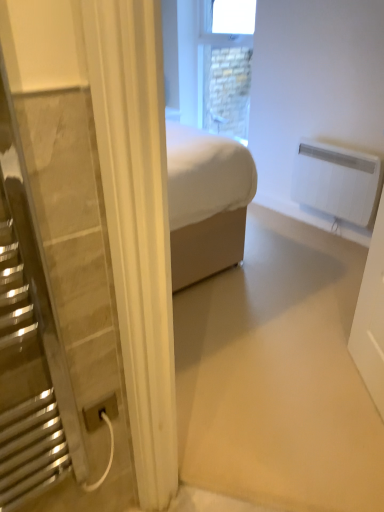
Question: Considering the relative sizes of white plastic radiator at upper right and white plastic power plug at lower left in the image provided, is white plastic radiator at upper right bigger than white plastic power plug at lower left?

Choices:
 (A) no
 (B) yes

Answer: (B)

Question: Is white plastic radiator at upper right at the right side of white plastic power plug at lower left?

Choices:
 (A) no
 (B) yes

Answer: (B)

Question: From a real-world perspective, is white plastic radiator at upper right beneath white plastic power plug at lower left?

Choices:
 (A) yes
 (B) no

Answer: (A)

Question: Is white plastic radiator at upper right further to the viewer compared to white plastic power plug at lower left?

Choices:
 (A) no
 (B) yes

Answer: (B)

Question: Is white plastic radiator at upper right closer to the viewer compared to white plastic power plug at lower left?

Choices:
 (A) yes
 (B) no

Answer: (B)

Question: From the image's perspective, is white plastic radiator at upper right on white plastic power plug at lower left?

Choices:
 (A) no
 (B) yes

Answer: (B)

Question: Is white plastic radiator at upper right oriented away from stone textured window at upper center?

Choices:
 (A) no
 (B) yes

Answer: (A)

Question: Is white plastic radiator at upper right closer to camera compared to stone textured window at upper center?

Choices:
 (A) yes
 (B) no

Answer: (A)

Question: Are white plastic radiator at upper right and stone textured window at upper center beside each other?

Choices:
 (A) yes
 (B) no

Answer: (B)

Question: Is stone textured window at upper center surrounded by white plastic radiator at upper right?

Choices:
 (A) yes
 (B) no

Answer: (B)

Question: Does white plastic radiator at upper right have a smaller size compared to stone textured window at upper center?

Choices:
 (A) yes
 (B) no

Answer: (A)

Question: Is white plastic radiator at upper right shorter than stone textured window at upper center?

Choices:
 (A) no
 (B) yes

Answer: (B)

Question: Is stone textured window at upper center beside white plastic power plug at lower left?

Choices:
 (A) no
 (B) yes

Answer: (A)